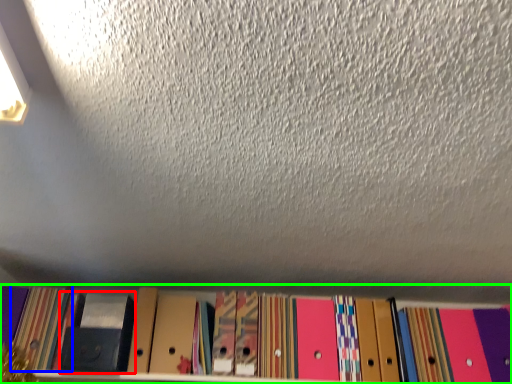
Question: Which object is positioned closest to paperback book (highlighted by a red box)? Select from paperback book (highlighted by a blue box) and shelf (highlighted by a green box).

Choices:
 (A) paperback book
 (B) shelf

Answer: (A)